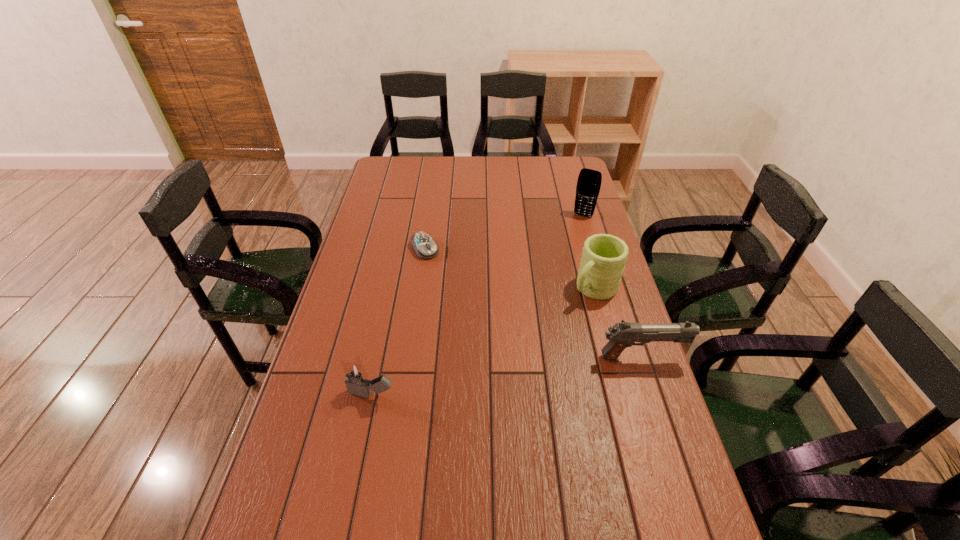
Locate an element on the screen. The image size is (960, 540). cellular telephone present at the right edge is located at coordinates (589, 181).

At what (x,y) coordinates should I click in order to perform the action: click on vacant space at the far edge of the desktop. Please return your answer as a coordinate pair (x, y). The image size is (960, 540). Looking at the image, I should click on (444, 161).

Locate an element on the screen. vacant area at the left edge of the desktop is located at coordinates (334, 325).

In the image, there is a desktop. Where is `free space at the right edge`? The width and height of the screenshot is (960, 540). free space at the right edge is located at coordinates (x=564, y=229).

In the image, there is a desktop. Identify the location of vacant space at the far left corner. (388, 165).

I want to click on free space at the near left corner, so point(306,515).

You are a GUI agent. You are given a task and a screenshot of the screen. Output one action in this format:
    pyautogui.click(x=<x>, y=<y>)
    Task: Click on the free spot at the far right corner of the desktop
    The width and height of the screenshot is (960, 540).
    Given the screenshot: What is the action you would take?
    pyautogui.click(x=552, y=158)

Identify the location of free space between the igniter and the gun. (507, 375).

At what (x,y) coordinates should I click in order to perform the action: click on free space that is in between the farthest object and the shortest object. Please return your answer as a coordinate pair (x, y). The width and height of the screenshot is (960, 540). Looking at the image, I should click on (504, 232).

Identify the location of empty space that is in between the fourth farthest object and the nearest object. Image resolution: width=960 pixels, height=540 pixels. (507, 375).